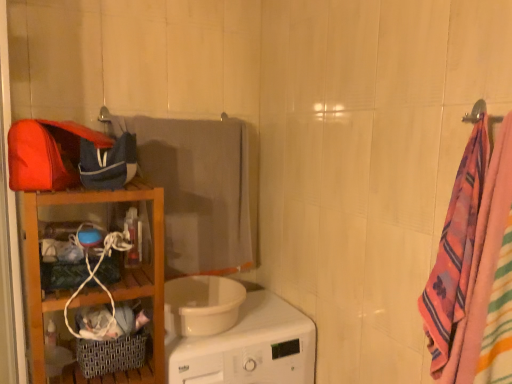
I want to click on spots to the right of gray fabric towel at center, the second beach towel from the front, so click(x=277, y=311).